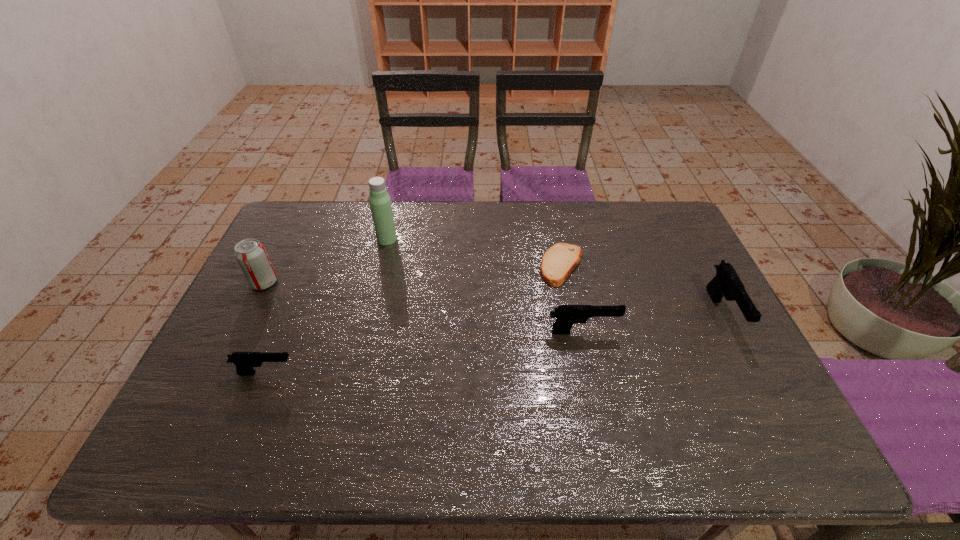
Please point a location where one more pistol can be added evenly. Please provide its 2D coordinates. Your answer should be formatted as a tuple, i.e. [(x, y)], where the tuple contains the x and y coordinates of a point satisfying the conditions above.

[(431, 352)]